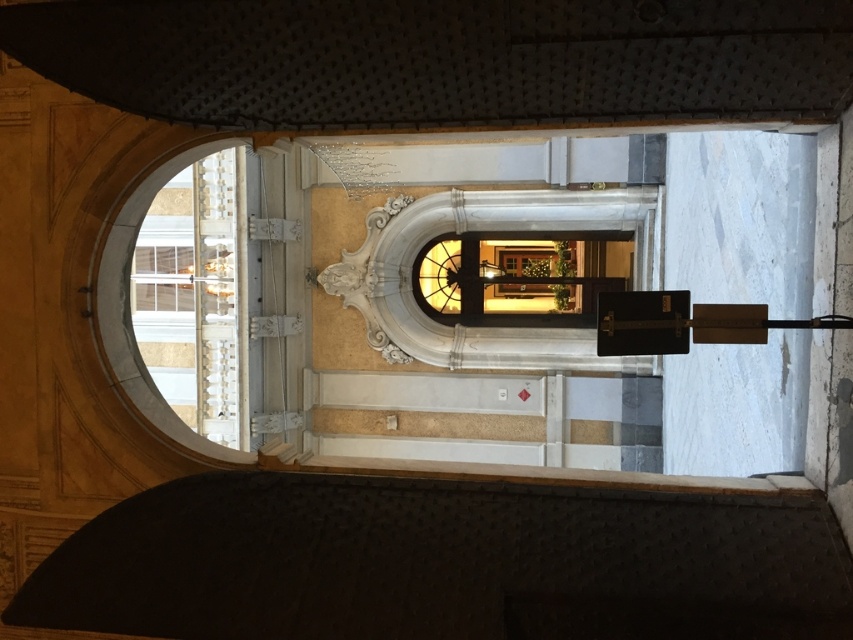
Question: Which object appears farthest from the camera in this image?

Choices:
 (A) white marble window at upper left
 (B) matte glass door at center

Answer: (B)

Question: Among these objects, which one is farthest from the camera?

Choices:
 (A) white marble window at upper left
 (B) matte glass door at center

Answer: (B)

Question: Which object is closer to the camera taking this photo?

Choices:
 (A) matte glass door at center
 (B) white marble window at upper left

Answer: (B)

Question: Observing the image, what is the correct spatial positioning of matte glass door at center in reference to white marble window at upper left?

Choices:
 (A) above
 (B) below

Answer: (A)

Question: Can you confirm if matte glass door at center is thinner than white marble window at upper left?

Choices:
 (A) no
 (B) yes

Answer: (A)

Question: Can you confirm if matte glass door at center is positioned to the left of white marble window at upper left?

Choices:
 (A) no
 (B) yes

Answer: (A)